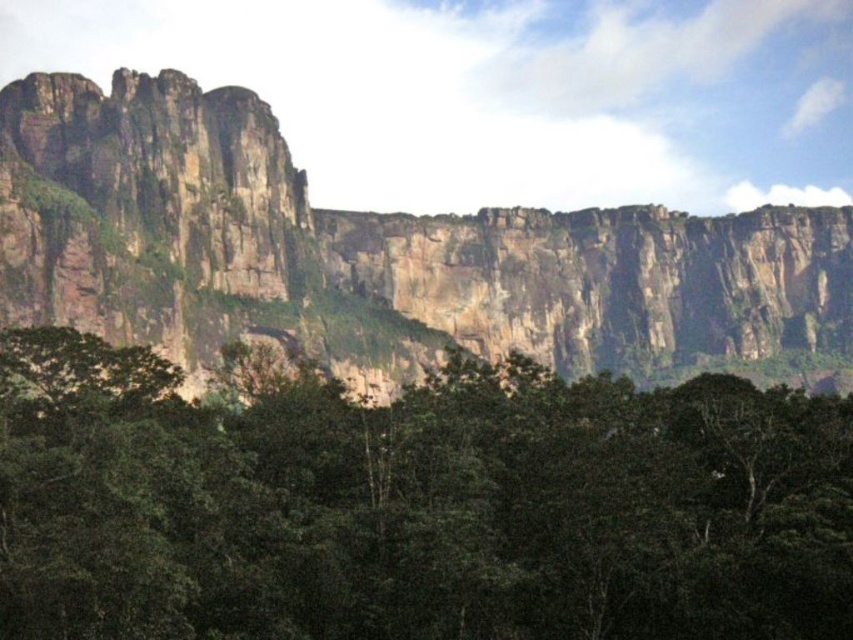
Question: Where is green leafy trees at center located in relation to rugged rock cliff at upper center in the image?

Choices:
 (A) left
 (B) right

Answer: (A)

Question: Which object appears farthest from the camera in this image?

Choices:
 (A) green leafy trees at center
 (B) rugged rock cliff at upper center

Answer: (B)

Question: Is green leafy trees at center to the left of rugged rock cliff at upper center from the viewer's perspective?

Choices:
 (A) no
 (B) yes

Answer: (B)

Question: Can you confirm if green leafy trees at center is smaller than rugged rock cliff at upper center?

Choices:
 (A) no
 (B) yes

Answer: (B)